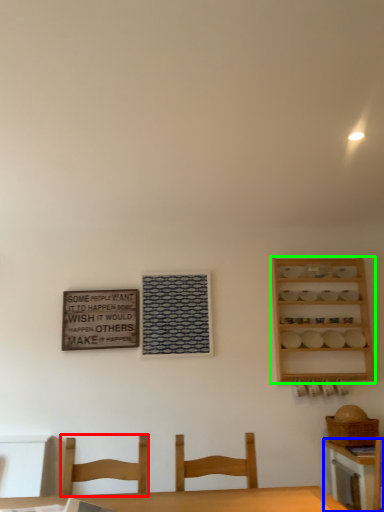
Question: Which is farther away from chair (highlighted by a red box)? table (highlighted by a blue box) or shelf (highlighted by a green box)?

Choices:
 (A) table
 (B) shelf

Answer: (B)